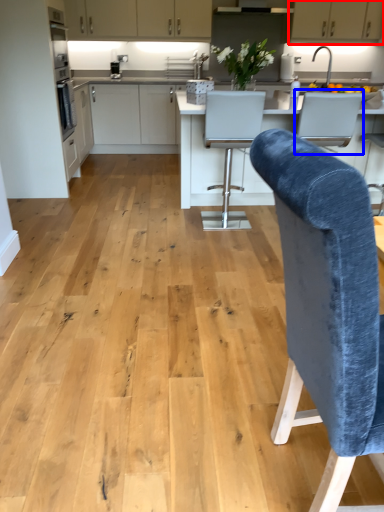
Question: Which object appears farthest to the camera in this image, cabinetry (highlighted by a red box) or armchair (highlighted by a blue box)?

Choices:
 (A) cabinetry
 (B) armchair

Answer: (A)